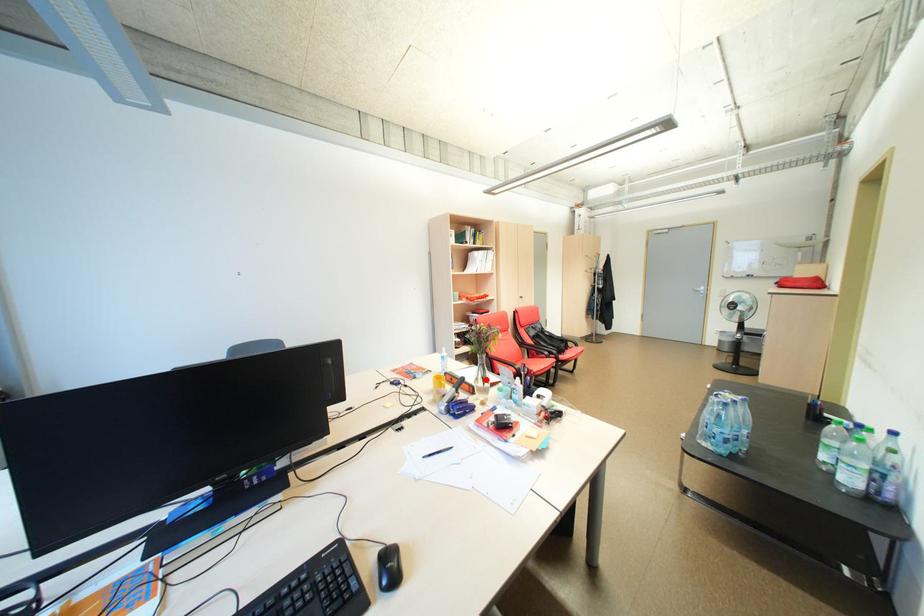
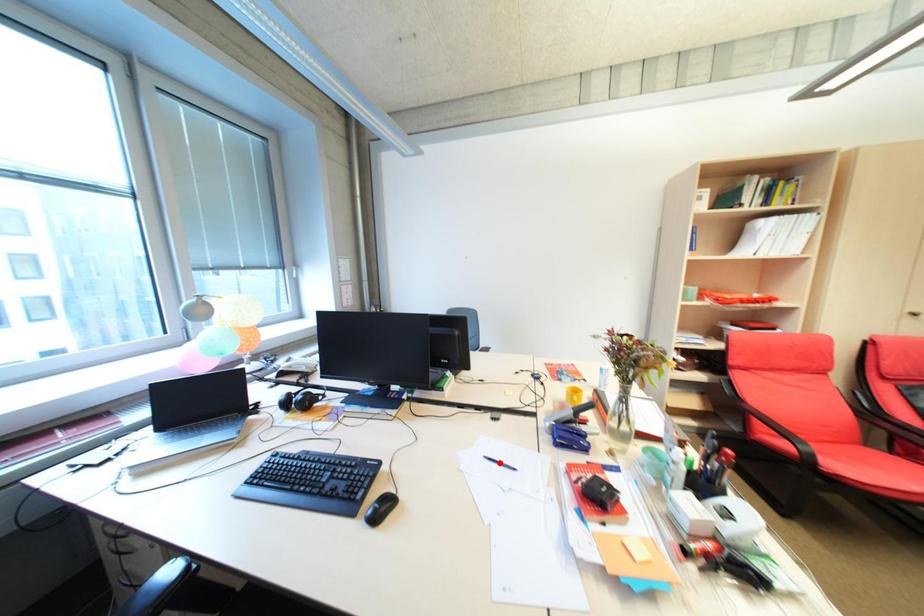
I am providing you with two images of the same scene from different viewpoints. A red point is marked on the first image and another point is marked on the second image. Are the points marked in image1 and image2 representing the same 3D position?

No